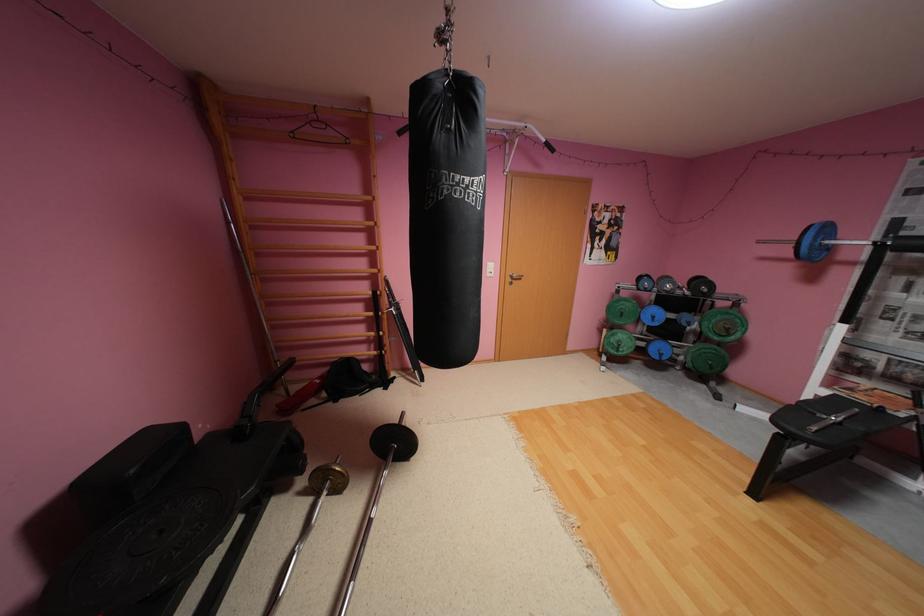
Where would you pull the silver door handle? Please return your answer as a coordinate pair (x, y).

(514, 277)